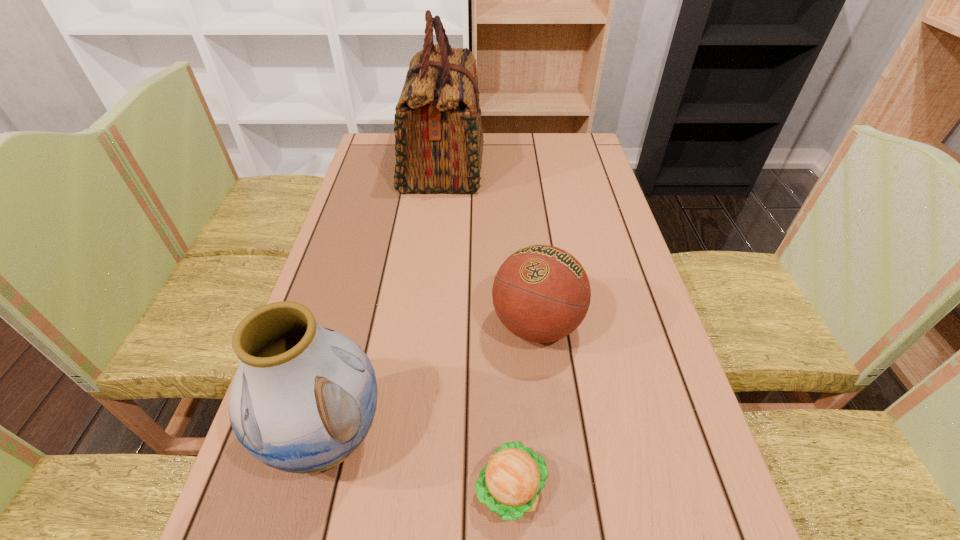
Where is `vacant space that satisfies the following two spatial constraints: 1. on the open handle side of the farthest object; 2. on the front side of the third shortest object`? This screenshot has width=960, height=540. vacant space that satisfies the following two spatial constraints: 1. on the open handle side of the farthest object; 2. on the front side of the third shortest object is located at coordinates coord(414,436).

You are a GUI agent. You are given a task and a screenshot of the screen. Output one action in this format:
    pyautogui.click(x=<x>, y=<y>)
    Task: Click on the vacant space that satisfies the following two spatial constraints: 1. on the open handle side of the third nearest object; 2. on the left side of the tallest object
    
    Given the screenshot: What is the action you would take?
    pyautogui.click(x=426, y=325)

Locate an element on the screen. free space in the image that satisfies the following two spatial constraints: 1. on the open handle side of the shopping bag; 2. on the right side of the hamburger is located at coordinates pyautogui.click(x=408, y=489).

What are the coordinates of `vacant region that satisfies the following two spatial constraints: 1. on the open handle side of the tallest object; 2. on the back side of the third nearest object` in the screenshot? It's located at (426, 325).

Where is `vacant point that satisfies the following two spatial constraints: 1. on the open handle side of the shopping bag; 2. on the back side of the basketball`? vacant point that satisfies the following two spatial constraints: 1. on the open handle side of the shopping bag; 2. on the back side of the basketball is located at coordinates (426, 325).

You are a GUI agent. You are given a task and a screenshot of the screen. Output one action in this format:
    pyautogui.click(x=<x>, y=<y>)
    Task: Click on the free space that satisfies the following two spatial constraints: 1. on the open handle side of the farthest object; 2. on the front side of the third shortest object
    
    Given the screenshot: What is the action you would take?
    click(414, 436)